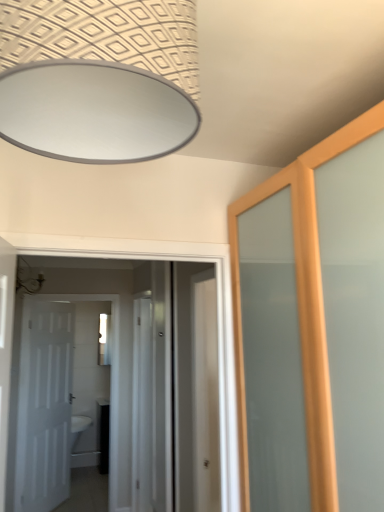
Question: Choose the correct answer: Is white glossy door at left, the 1th door viewed from the left, inside clear glass mirror at center or outside it?

Choices:
 (A) outside
 (B) inside

Answer: (A)

Question: Is point click(x=81, y=379) positioned closer to the camera than point click(x=102, y=338)?

Choices:
 (A) farther
 (B) closer

Answer: (B)

Question: Which object is the farthest from the white glossy door at center, acting as the 2th door starting from the back?

Choices:
 (A) clear glass screen door at center
 (B) white glossy door at left, the 1th door viewed from the left
 (C) clear glass mirror at center

Answer: (C)

Question: Which object is positioned closest to the white glossy door at left, arranged as the second door when viewed from the front?

Choices:
 (A) white glossy door at center, the second door viewed from the left
 (B) clear glass screen door at center
 (C) clear glass mirror at center

Answer: (A)